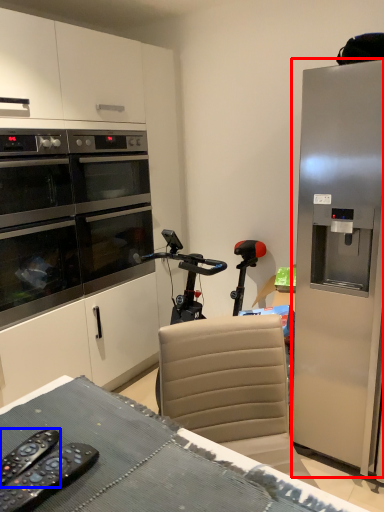
Question: Which point is further to the camera, refrigerator (highlighted by a red box) or remote control (highlighted by a blue box)?

Choices:
 (A) refrigerator
 (B) remote control

Answer: (A)